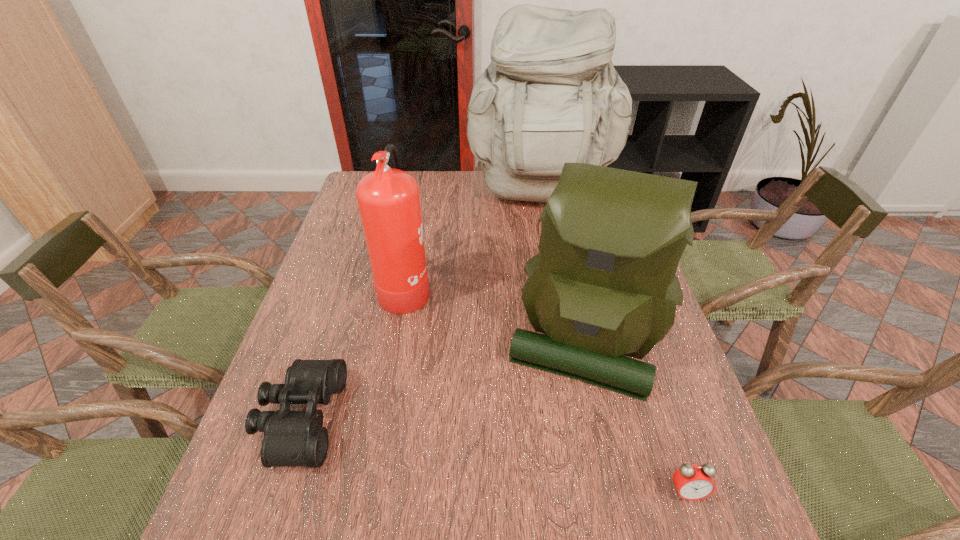
Where is `vacant space located 0.050m on the front-facing side of the alarm clock`? The image size is (960, 540). vacant space located 0.050m on the front-facing side of the alarm clock is located at coordinates (701, 534).

Identify the location of object located in the far edge section of the desktop. (551, 95).

Locate an element on the screen. object located in the left edge section of the desktop is located at coordinates (291, 438).

The height and width of the screenshot is (540, 960). Identify the location of alarm clock that is at the right edge. (693, 482).

At what (x,y) coordinates should I click in order to perform the action: click on object positioned at the far right corner. Please return your answer as a coordinate pair (x, y). Looking at the image, I should click on (551, 95).

Locate an element on the screen. free location at the far edge of the desktop is located at coordinates (485, 202).

Locate an element on the screen. This screenshot has width=960, height=540. blank space at the near edge is located at coordinates (414, 538).

This screenshot has height=540, width=960. In order to click on vacant space at the left edge of the desktop in this screenshot , I will do `click(313, 318)`.

The height and width of the screenshot is (540, 960). In the image, there is a desktop. Identify the location of vacant region at the far left corner. (356, 191).

Find the location of a particular element. free space between the nearer backpack and the fire extinguisher is located at coordinates (494, 312).